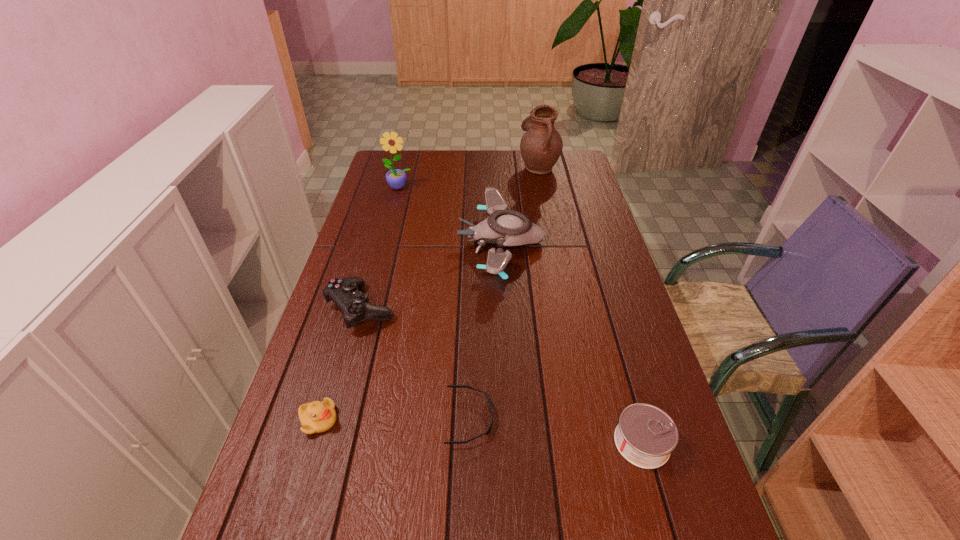
I want to click on vacant space that satisfies the following two spatial constraints: 1. at the spout of the farthest object; 2. on the front-facing side of the second farthest object, so pos(542,187).

Locate an element on the screen. vacant space that satisfies the following two spatial constraints: 1. at the spout of the farthest object; 2. on the front-facing side of the sunflower is located at coordinates (542, 187).

At what (x,y) coordinates should I click in order to perform the action: click on free location that satisfies the following two spatial constraints: 1. on the front-facing side of the second farthest object; 2. on the left side of the can. Please return your answer as a coordinate pair (x, y). This screenshot has height=540, width=960. Looking at the image, I should click on (333, 443).